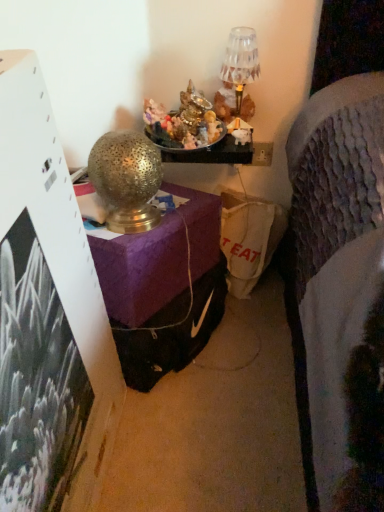
Question: Looking at their shapes, would you say gold textured lamp at upper center, the first table lamp when ordered from left to right, is wider or thinner than crystal glass table lamp at upper center, placed as the second table lamp when sorted from front to back?

Choices:
 (A) wide
 (B) thin

Answer: (A)

Question: From their relative heights in the image, would you say gold textured lamp at upper center, which is the second table lamp from back to front, is taller or shorter than crystal glass table lamp at upper center, placed as the second table lamp when sorted from front to back?

Choices:
 (A) short
 (B) tall

Answer: (B)

Question: Is gold textured lamp at upper center, which is the second table lamp from back to front, inside or outside of crystal glass table lamp at upper center, placed as the second table lamp when sorted from front to back?

Choices:
 (A) inside
 (B) outside

Answer: (B)

Question: Considering the positions of crystal glass table lamp at upper center, which ranks as the 1th table lamp in top-to-bottom order, and gold textured lamp at upper center, placed as the 2th table lamp when sorted from right to left, in the image, is crystal glass table lamp at upper center, which ranks as the 1th table lamp in top-to-bottom order, bigger or smaller than gold textured lamp at upper center, placed as the 2th table lamp when sorted from right to left,?

Choices:
 (A) big
 (B) small

Answer: (B)

Question: From their relative heights in the image, would you say crystal glass table lamp at upper center, which ranks as the 1th table lamp in back-to-front order, is taller or shorter than gold textured lamp at upper center, which ranks as the 1th table lamp in front-to-back order?

Choices:
 (A) short
 (B) tall

Answer: (A)

Question: From the image's perspective, is crystal glass table lamp at upper center, the first table lamp from the right, above or below gold textured lamp at upper center, which ranks as the 1th table lamp in front-to-back order?

Choices:
 (A) below
 (B) above

Answer: (B)

Question: Is crystal glass table lamp at upper center, which ranks as the 1th table lamp in top-to-bottom order, situated inside gold textured lamp at upper center, the 1th table lamp when ordered from bottom to top, or outside?

Choices:
 (A) outside
 (B) inside

Answer: (A)